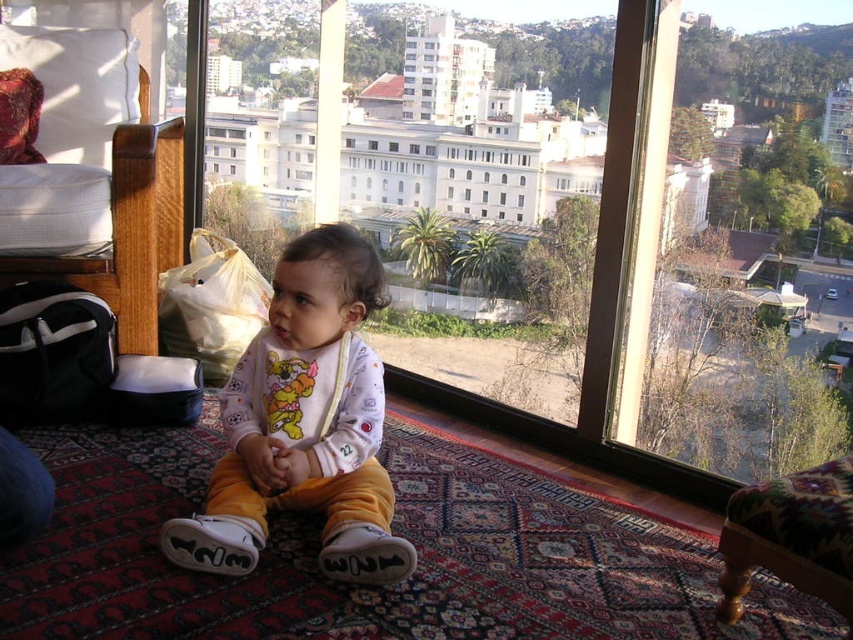
Can you confirm if white cotton bib at center is positioned below wooden armchair at lower right?

No, white cotton bib at center is not below wooden armchair at lower right.

Between point (281, 339) and point (779, 541), which one is positioned behind?

Positioned behind is point (281, 339).

Does point (349, 464) come in front of point (819, 548)?

No, (349, 464) is behind (819, 548).

Identify the location of white cotton bib at center. (305, 422).

Who is positioned more to the left, transparent glass door at center or wooden armchair at lower right?

From the viewer's perspective, transparent glass door at center appears more on the left side.

Can you confirm if transparent glass door at center is positioned below wooden armchair at lower right?

No.

Is point (671, 196) less distant than point (735, 520)?

No, (671, 196) is further to viewer.

I want to click on transparent glass door at center, so click(x=604, y=218).

Is transparent glass door at center above white cotton bib at center?

Yes.

Does point (706, 246) come in front of point (273, 362)?

No, it is not.

Find the location of a particular element. The width and height of the screenshot is (853, 640). transparent glass door at center is located at coordinates (604, 218).